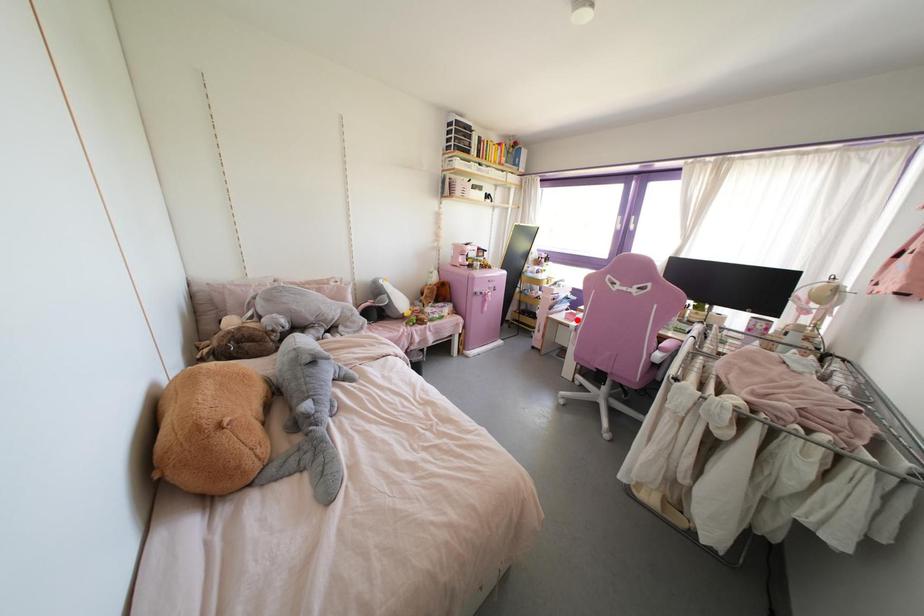
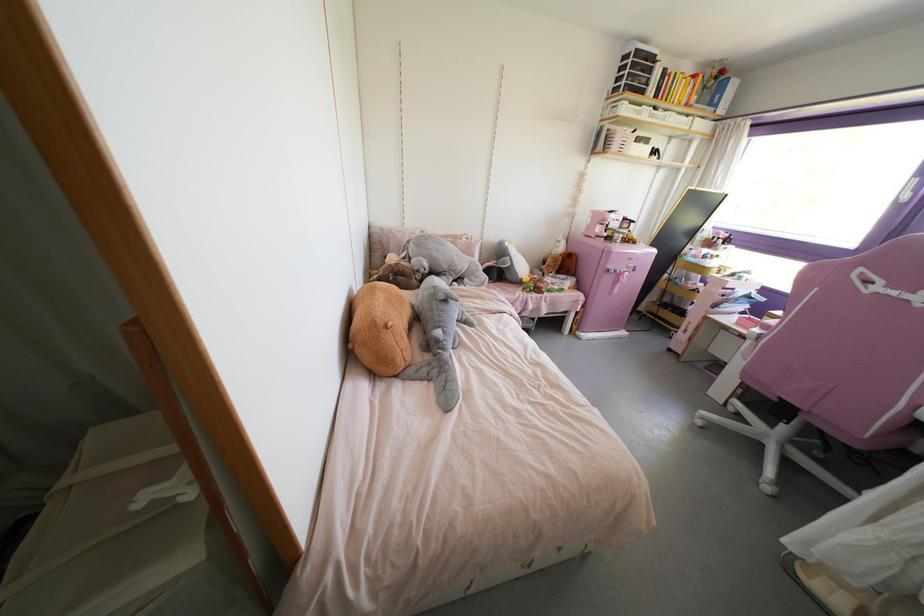
Question: I am providing you with two images of the same scene from different viewpoints. In image1, a red point is highlighted. Considering the same 3D point in image2, which of the following is correct?

Choices:
 (A) It is closer
 (B) It is farther

Answer: (B)